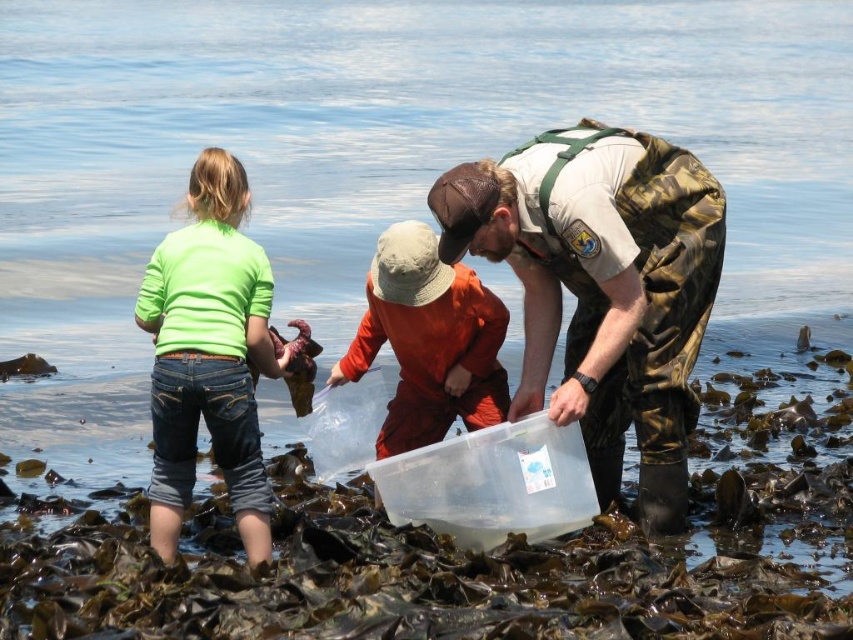
Where is the camouflage pants at center located in the image?

The camouflage pants at center is located at point (x=602, y=288).

You are standing at the coastal area and want to walk from point A to point B. Point A is at coordinates point (544, 234) and point B is at point (190, 417). Since you want to avoid getting too close to the water, which direction should you head towards from point A to reach point B while staying on the drier ground?

You should head towards the lower right direction from point A to point B because point A is closer to the viewer than point B, meaning the ground slopes downward towards the water. Moving towards the lower right keeps you on higher, drier ground away from the water.